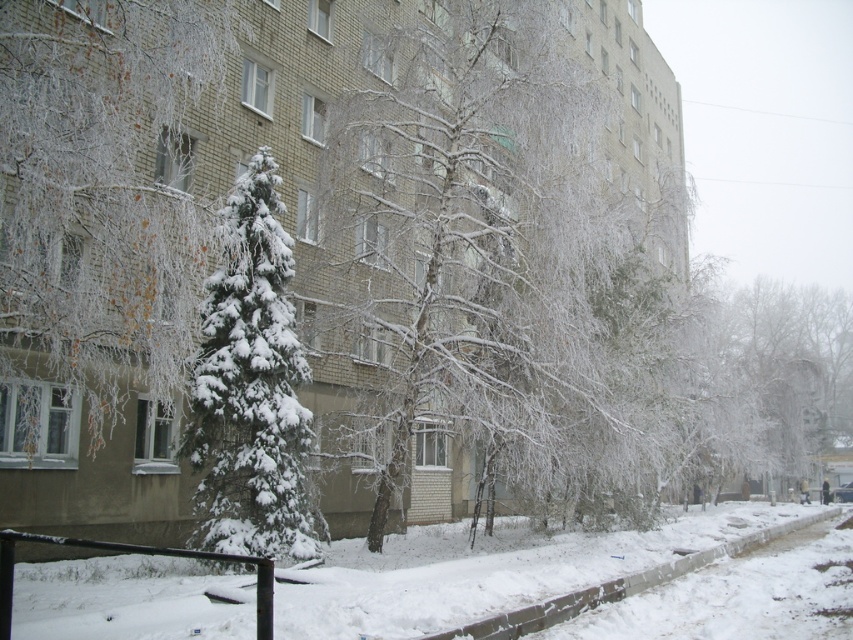
Question: Which object appears farthest from the camera in this image?

Choices:
 (A) snow-covered evergreen at left
 (B) icy white branches at center
 (C) white snow pavement at lower center
 (D) snow-covered evergreen at center

Answer: (B)

Question: Based on their relative distances, which object is nearer to the icy white branches at center?

Choices:
 (A) snow-covered evergreen at center
 (B) snow-covered evergreen at left

Answer: (A)

Question: Is icy white branches at center to the right of snow-covered evergreen at center from the viewer's perspective?

Choices:
 (A) yes
 (B) no

Answer: (A)

Question: Among these objects, which one is farthest from the camera?

Choices:
 (A) snow-covered evergreen at left
 (B) snow-covered evergreen at center

Answer: (B)

Question: Can you confirm if white snow pavement at lower center is wider than snow-covered evergreen at center?

Choices:
 (A) no
 (B) yes

Answer: (B)

Question: Can you confirm if icy white branches at center is positioned to the left of white snow pavement at lower center?

Choices:
 (A) no
 (B) yes

Answer: (A)